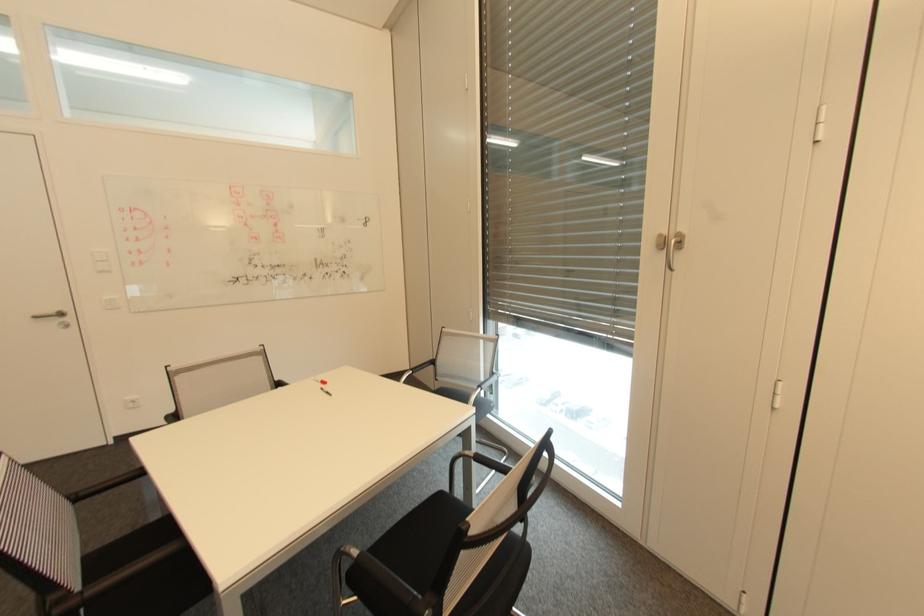
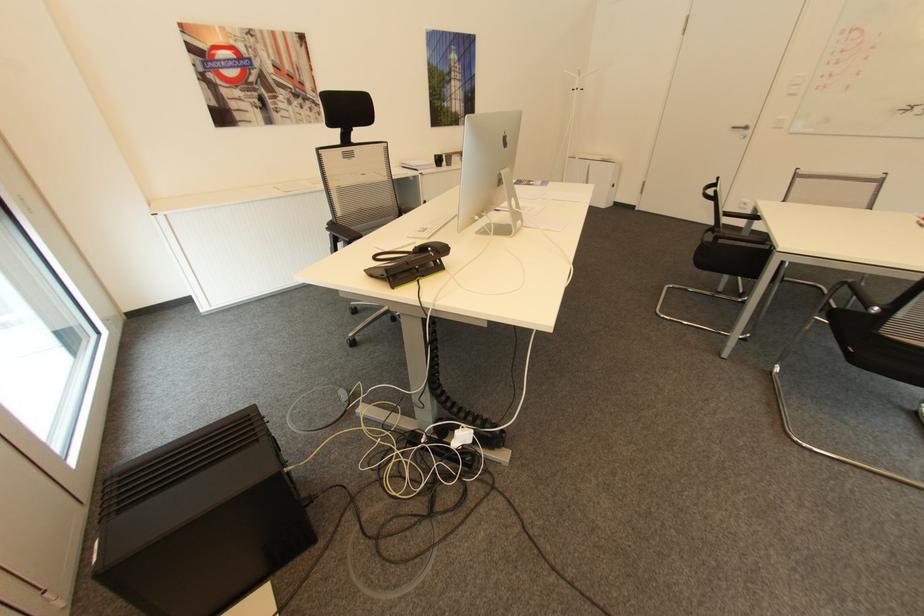
Find the pixel in the second image that matches [67,314] in the first image.

(749, 128)